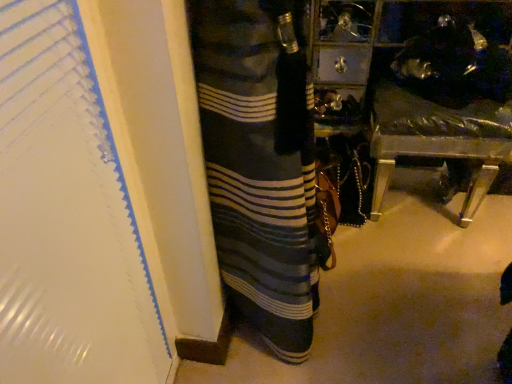
Where is `metallic silver table at right`? The image size is (512, 384). metallic silver table at right is located at coordinates (444, 91).

The image size is (512, 384). What do you see at coordinates (444, 91) in the screenshot?
I see `metallic silver table at right` at bounding box center [444, 91].

Find the location of a particular element. The width and height of the screenshot is (512, 384). metallic silver table at right is located at coordinates (444, 91).